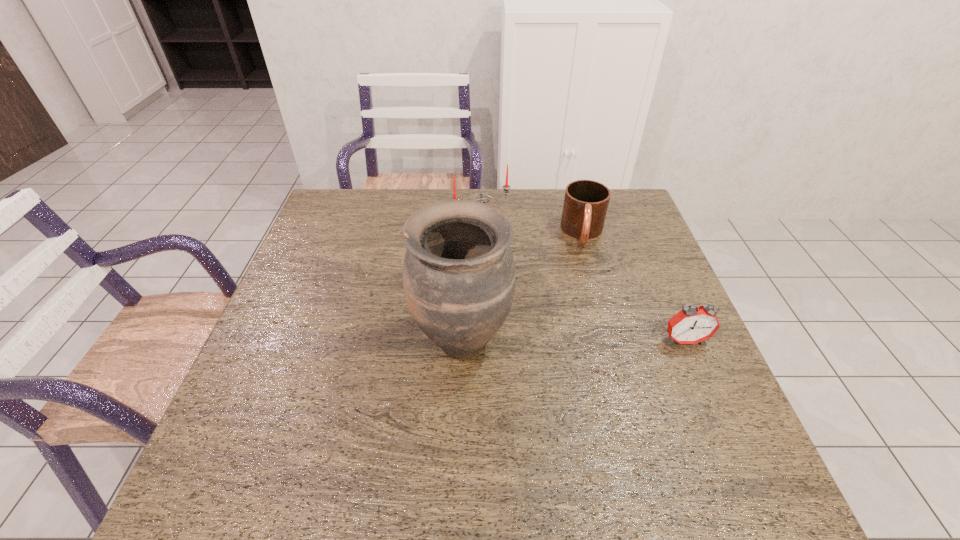
In order to click on free space on the desktop that is between the tallest object and the alarm clock and is positioned on the front-facing side of the candle in this screenshot , I will do `click(568, 340)`.

Find the location of a particular element. Image resolution: width=960 pixels, height=540 pixels. free space on the desktop that is between the tallest object and the alarm clock and is positioned on the side of the second object from right to left with the handle is located at coordinates (585, 340).